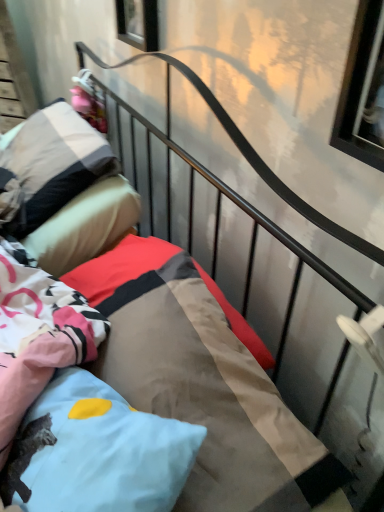
Question: Considering the relative sizes of textured cotton mattress at center and pink fabric doll at upper left in the image provided, is textured cotton mattress at center shorter than pink fabric doll at upper left?

Choices:
 (A) yes
 (B) no

Answer: (B)

Question: Would you say pink fabric doll at upper left is part of textured cotton mattress at center's contents?

Choices:
 (A) yes
 (B) no

Answer: (B)

Question: Is textured cotton mattress at center at the left side of pink fabric doll at upper left?

Choices:
 (A) yes
 (B) no

Answer: (B)

Question: From a real-world perspective, is textured cotton mattress at center on pink fabric doll at upper left?

Choices:
 (A) yes
 (B) no

Answer: (B)

Question: Is textured cotton mattress at center not inside pink fabric doll at upper left?

Choices:
 (A) no
 (B) yes

Answer: (B)

Question: Looking at their shapes, would you say transparent glass window at upper center, arranged as the 2th window when viewed from the right, is wider or thinner than soft cotton pillow at upper left, which is the 1th pillow in top-to-bottom order?

Choices:
 (A) thin
 (B) wide

Answer: (A)

Question: From the image's perspective, relative to soft cotton pillow at upper left, which appears as the 1th pillow when viewed from the back, is transparent glass window at upper center, which is the 1th window from top to bottom, above or below?

Choices:
 (A) above
 (B) below

Answer: (A)

Question: Is transparent glass window at upper center, arranged as the 2th window when viewed from the right, bigger or smaller than soft cotton pillow at upper left, marked as the second pillow in a bottom-to-top arrangement?

Choices:
 (A) small
 (B) big

Answer: (A)

Question: From their relative heights in the image, would you say transparent glass window at upper center, the 2th window from the bottom, is taller or shorter than soft cotton pillow at upper left, the second pillow positioned from the front?

Choices:
 (A) tall
 (B) short

Answer: (B)

Question: Considering the positions of clear glass window at upper right, acting as the 2th window starting from the left, and transparent glass window at upper center, arranged as the 2th window when viewed from the right, in the image, is clear glass window at upper right, acting as the 2th window starting from the left, bigger or smaller than transparent glass window at upper center, arranged as the 2th window when viewed from the right,?

Choices:
 (A) big
 (B) small

Answer: (B)

Question: Would you say clear glass window at upper right, which is the 2th window from top to bottom, is to the left or to the right of transparent glass window at upper center, arranged as the 2th window when viewed from the right, in the picture?

Choices:
 (A) right
 (B) left

Answer: (A)

Question: From a real-world perspective, is clear glass window at upper right, which is the 2th window from top to bottom, above or below transparent glass window at upper center, which is the second window from front to back?

Choices:
 (A) above
 (B) below

Answer: (A)

Question: Considering their positions, is clear glass window at upper right, acting as the first window starting from the bottom, located in front of or behind transparent glass window at upper center, the 2th window from the bottom?

Choices:
 (A) behind
 (B) front

Answer: (B)

Question: Is light blue fabric pillow at center, the first pillow ordered from the bottom, wider or thinner than clear glass window at upper right, which is the 2th window from top to bottom?

Choices:
 (A) wide
 (B) thin

Answer: (A)

Question: In terms of size, does light blue fabric pillow at center, the first pillow ordered from the bottom, appear bigger or smaller than clear glass window at upper right, acting as the 2th window starting from the left?

Choices:
 (A) big
 (B) small

Answer: (A)